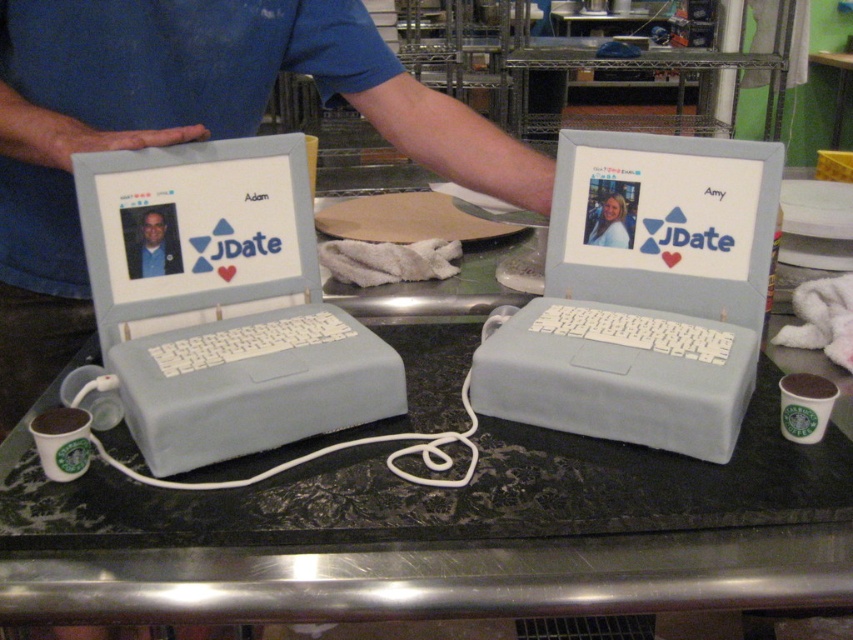
Is point (732, 508) farther from viewer compared to point (39, 432)?

No, it is in front of (39, 432).

This screenshot has height=640, width=853. I want to click on black marble counter top at center, so click(442, 532).

Where is `black marble counter top at center`? black marble counter top at center is located at coordinates (442, 532).

Image resolution: width=853 pixels, height=640 pixels. In order to click on black marble counter top at center in this screenshot , I will do `click(442, 532)`.

Between point (747, 376) and point (38, 454), which one is positioned behind?

The point (747, 376) is behind.

Is gray fondant laptop at center behind matte white cup at lower left?

Yes, it is behind matte white cup at lower left.

Between point (659, 401) and point (71, 433), which one is positioned in front?

Positioned in front is point (71, 433).

What are the coordinates of `gray fondant laptop at center` in the screenshot? It's located at (643, 294).

Describe the element at coordinates (225, 307) in the screenshot. This screenshot has height=640, width=853. I see `matte gray laptop at center` at that location.

Can you confirm if matte gray laptop at center is positioned below gray fondant laptop at center?

Indeed, matte gray laptop at center is positioned under gray fondant laptop at center.

Which is in front, point (323, 339) or point (613, 420)?

Positioned in front is point (613, 420).

Find the location of `matte gray laptop at center`. matte gray laptop at center is located at coordinates (225, 307).